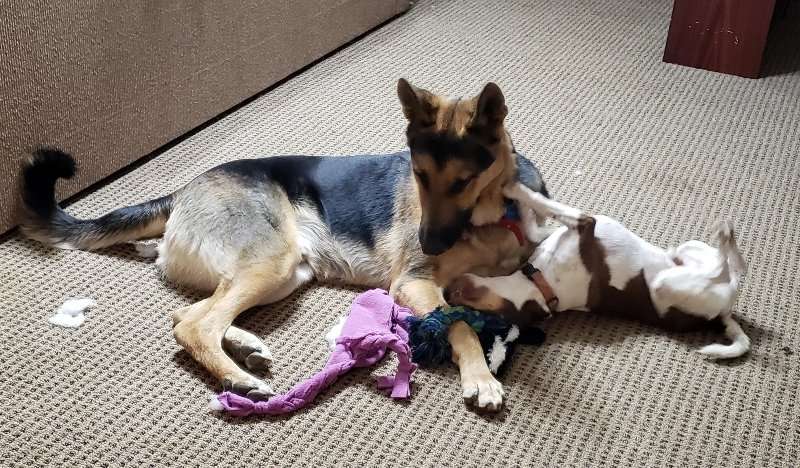
You are a GUI agent. You are given a task and a screenshot of the screen. Output one action in this format:
    pyautogui.click(x=<x>, y=<y>)
    Task: Click on the wood furniture
    This screenshot has height=468, width=800.
    Given the screenshot: What is the action you would take?
    pyautogui.click(x=689, y=39)